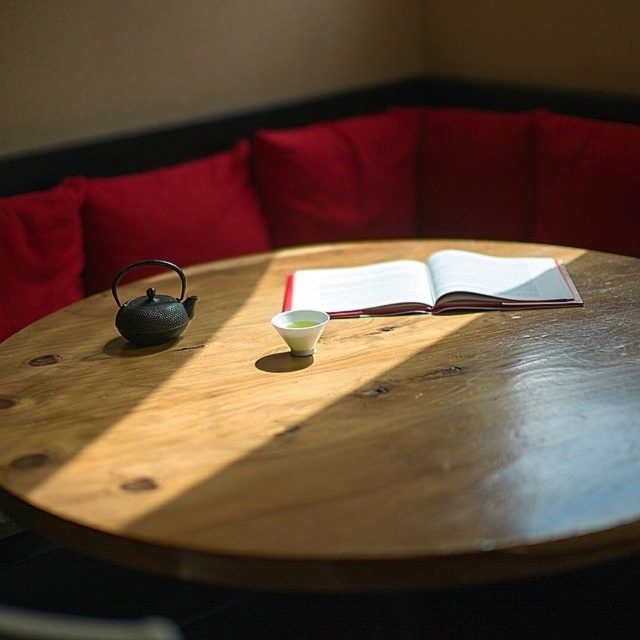
Question: Can you confirm if wooden table at center is positioned to the left of velvet red cushion at left?

Choices:
 (A) yes
 (B) no

Answer: (B)

Question: Which point is farther from the camera taking this photo?

Choices:
 (A) (24, 250)
 (B) (177, 301)
 (C) (390, 301)
 (D) (228, 136)

Answer: (D)

Question: Does velvet red couch at upper center have a larger size compared to velvet red cushion at left?

Choices:
 (A) yes
 (B) no

Answer: (A)

Question: Can you confirm if velvet red couch at upper center is positioned to the right of black textured teapot at left?

Choices:
 (A) no
 (B) yes

Answer: (B)

Question: Which is farther from the velvet red pillow at upper left?

Choices:
 (A) black textured teapot at left
 (B) white paper book at center
 (C) wooden table at center
 (D) velvet red couch at upper center

Answer: (B)

Question: Which object is closer to the camera taking this photo?

Choices:
 (A) wooden table at center
 (B) white paper book at center
 (C) velvet red couch at upper center
 (D) black textured teapot at left

Answer: (A)